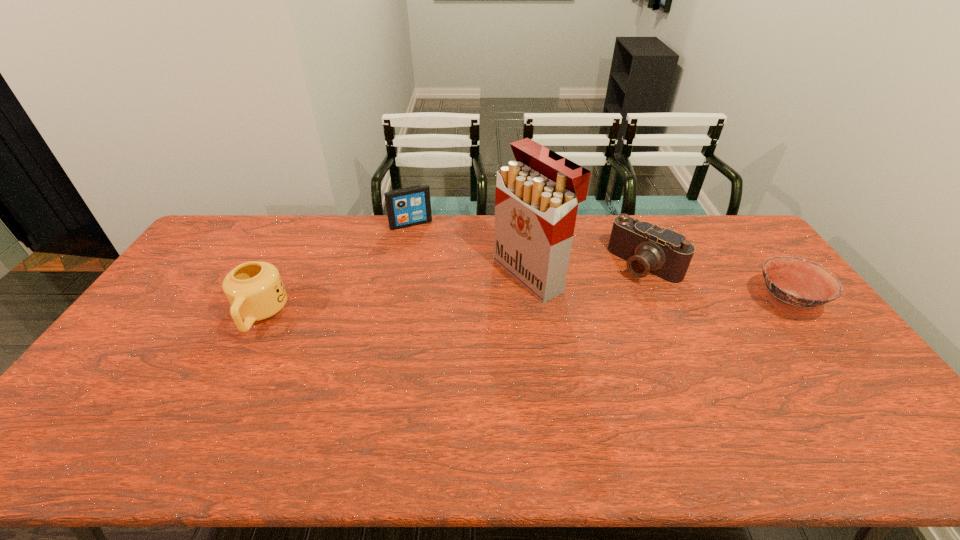
Identify the location of unoccupied position between the mug and the third object from left to right. This screenshot has width=960, height=540. (396, 295).

Where is `free space between the tallest object and the mug`? free space between the tallest object and the mug is located at coordinates (x=396, y=295).

I want to click on vacant space that is in between the mug and the third object from left to right, so click(x=396, y=295).

Locate an element on the screen. Image resolution: width=960 pixels, height=540 pixels. vacant space that's between the farthest object and the mug is located at coordinates (336, 269).

Where is `vacant area that lies between the bowl and the second object from right to left`? vacant area that lies between the bowl and the second object from right to left is located at coordinates (715, 284).

I want to click on free spot between the shortest object and the leftmost object, so click(x=523, y=309).

Identify the location of empty location between the mug and the tallest object. (396, 295).

Locate an element on the screen. The width and height of the screenshot is (960, 540). vacant point located between the camera and the shortest object is located at coordinates (715, 284).

Locate which object ranks second in proximity to the shortest object. Please provide its 2D coordinates. Your answer should be formatted as a tuple, i.e. [(x, y)], where the tuple contains the x and y coordinates of a point satisfying the conditions above.

[(536, 200)]

Identify which object is the third closest to the bowl. Please provide its 2D coordinates. Your answer should be formatted as a tuple, i.e. [(x, y)], where the tuple contains the x and y coordinates of a point satisfying the conditions above.

[(410, 206)]